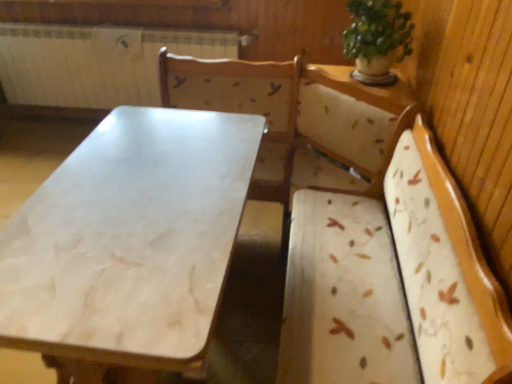
Question: Considering their positions, is white painted metal radiator at upper left located in front of or behind green leafy plant at upper right?

Choices:
 (A) front
 (B) behind

Answer: (B)

Question: Looking at their shapes, would you say white painted metal radiator at upper left is wider or thinner than green leafy plant at upper right?

Choices:
 (A) thin
 (B) wide

Answer: (A)

Question: Estimate the real-world distances between objects in this image. Which object is closer to the white marble table at center?

Choices:
 (A) green leafy plant at upper right
 (B) white painted metal radiator at upper left

Answer: (A)

Question: Based on their relative distances, which object is nearer to the white painted metal radiator at upper left?

Choices:
 (A) white marble table at center
 (B) green leafy plant at upper right

Answer: (B)